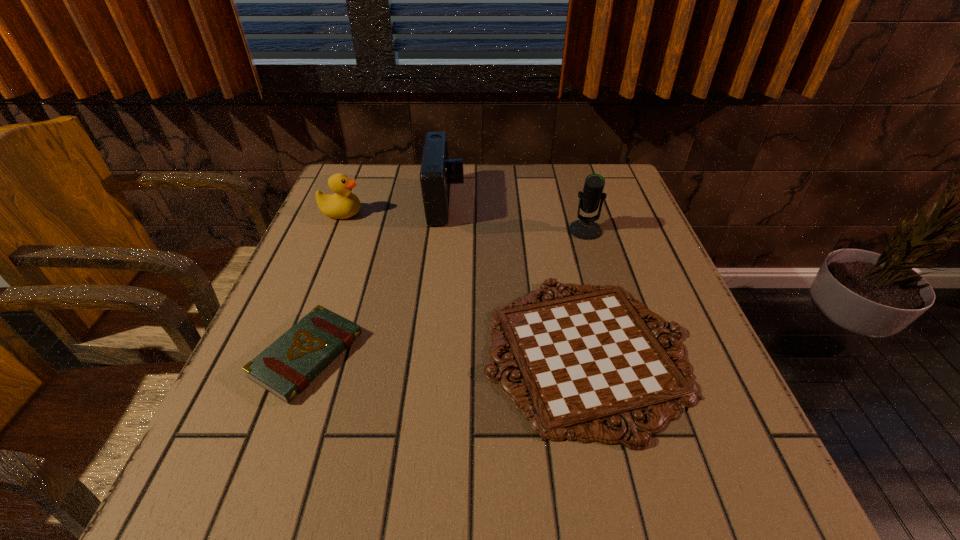
This screenshot has height=540, width=960. In the image, there is a desktop. In order to click on vacant space at the right edge in this screenshot , I will do `click(619, 250)`.

Where is `vacant region at the far left corner of the desktop`? vacant region at the far left corner of the desktop is located at coordinates (x=381, y=201).

I want to click on free space between the third tallest object and the book, so click(x=324, y=284).

Locate an element on the screen. This screenshot has height=540, width=960. vacant region between the shortest object and the camera is located at coordinates (516, 278).

Identify the location of vacant area that lies between the third object from left to right and the shortest object. This screenshot has height=540, width=960. (516, 278).

The width and height of the screenshot is (960, 540). I want to click on unoccupied area between the duck and the shortest object, so click(x=464, y=282).

Locate an element on the screen. This screenshot has width=960, height=540. free point between the microphone and the fourth tallest object is located at coordinates (446, 293).

Locate an element on the screen. The height and width of the screenshot is (540, 960). unoccupied position between the duck and the fourth tallest object is located at coordinates (324, 284).

Locate an element on the screen. The height and width of the screenshot is (540, 960). object that is the second nearest to the camera is located at coordinates (586, 359).

Locate an element on the screen. object that is the closest to the chessboard is located at coordinates (585, 228).